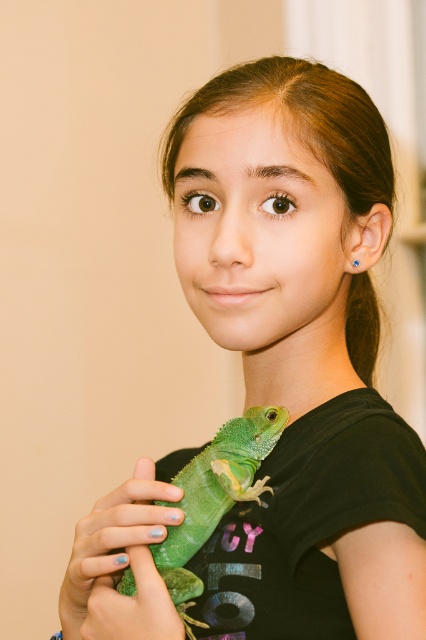
The width and height of the screenshot is (426, 640). Describe the element at coordinates (120, 564) in the screenshot. I see `green matte lizard at lower left` at that location.

Does point (104, 538) come farther from viewer compared to point (204, 483)?

No, it is in front of (204, 483).

This screenshot has width=426, height=640. What are the coordinates of `green matte lizard at lower left` in the screenshot? It's located at (120, 564).